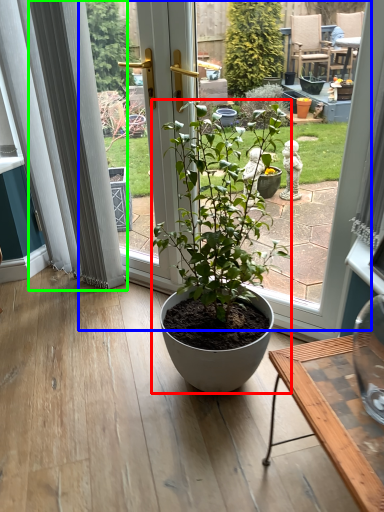
Question: Considering the real-world distances, which object is closest to houseplant (highlighted by a red box)? bay window (highlighted by a blue box) or curtain (highlighted by a green box).

Choices:
 (A) bay window
 (B) curtain

Answer: (A)